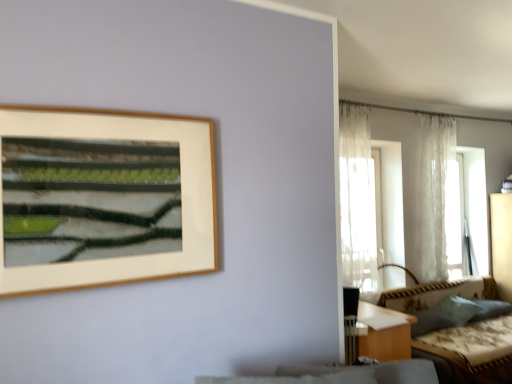
Question: Based on their sizes in the image, would you say textured beige couch at lower right is bigger or smaller than translucent fabric window at right?

Choices:
 (A) small
 (B) big

Answer: (B)

Question: Do you think textured beige couch at lower right is within translucent fabric window at right, or outside of it?

Choices:
 (A) inside
 (B) outside

Answer: (B)

Question: Estimate the real-world distances between objects in this image. Which object is closer to the sheer white curtain at right, which ranks as the second curtain in back-to-front order?

Choices:
 (A) translucent fabric window at right
 (B) white sheer curtain at upper right, which is the second curtain in front-to-back order
 (C) green fabric pillow at lower right
 (D) textured beige couch at lower right

Answer: (B)

Question: Which is nearer to the translucent fabric window at right?

Choices:
 (A) sheer white curtain at right, which is the first curtain in left-to-right order
 (B) textured beige couch at lower right
 (C) green fabric pillow at lower right
 (D) white sheer curtain at upper right, the second curtain when ordered from left to right

Answer: (D)